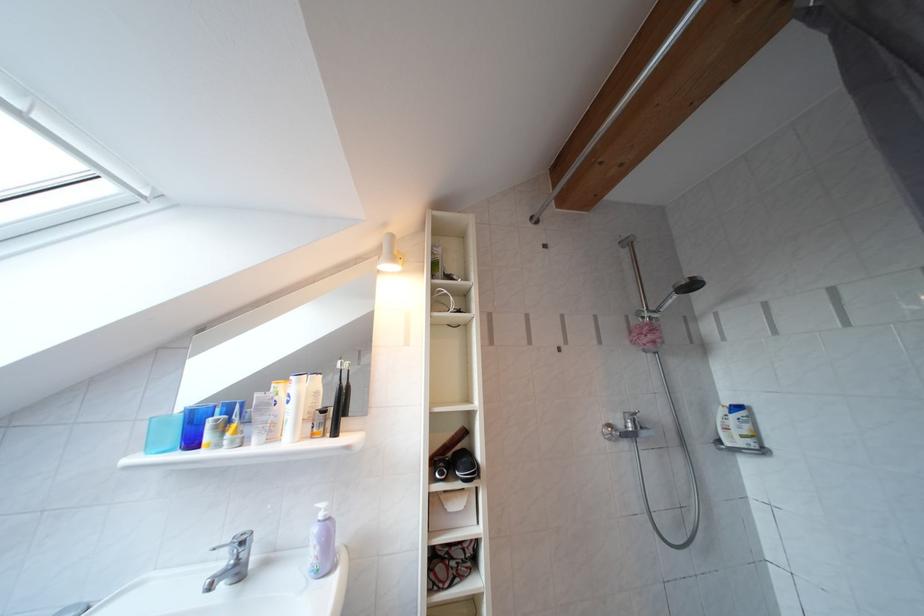
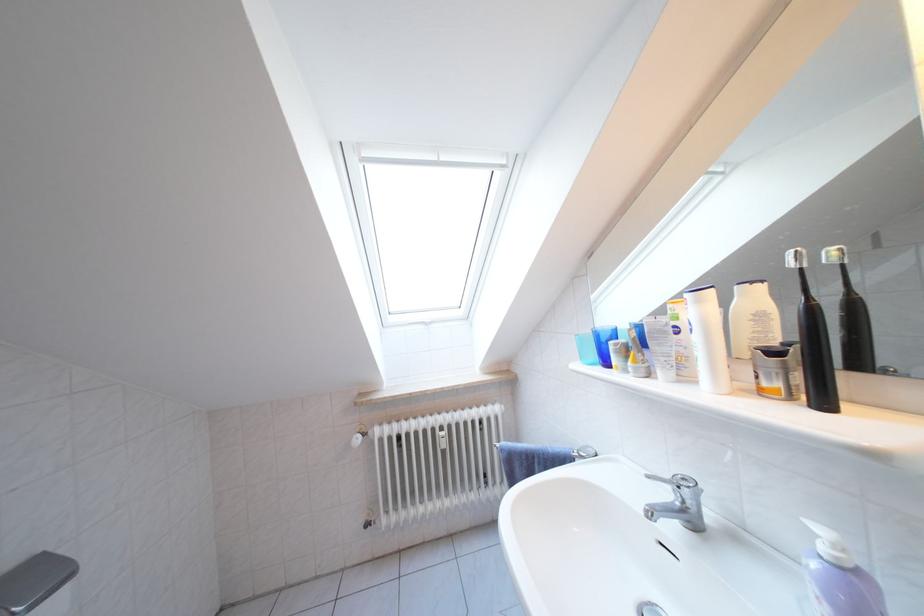
In the second image, find the point that corresponds to [344,438] in the first image.

(833, 407)